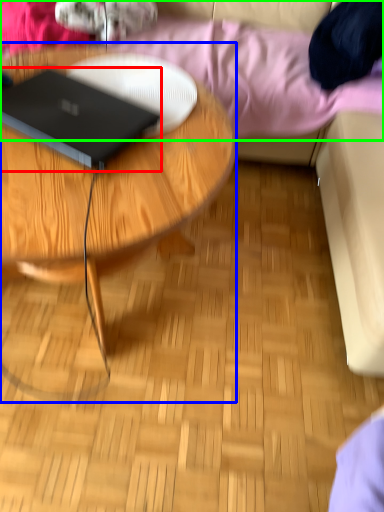
Question: Considering the real-world distances, which object is closest to laptop (highlighted by a red box)? coffee table (highlighted by a blue box) or bedding (highlighted by a green box).

Choices:
 (A) coffee table
 (B) bedding

Answer: (A)